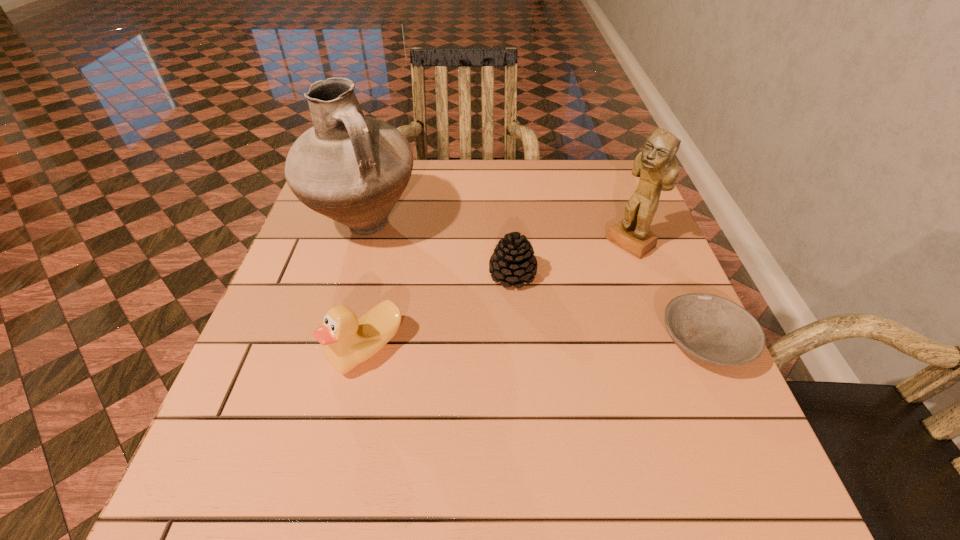
The height and width of the screenshot is (540, 960). I want to click on free space between the pinecone and the shortest object, so click(609, 309).

Find the location of `unoccupied position between the bowl and the duck`. unoccupied position between the bowl and the duck is located at coordinates (536, 346).

At what (x,y) coordinates should I click in order to perform the action: click on free spot between the third object from right to left and the pitcher. Please return your answer as a coordinate pair (x, y). This screenshot has height=540, width=960. Looking at the image, I should click on (439, 250).

What are the coordinates of `free space between the duck and the fourth shortest object` in the screenshot? It's located at (498, 296).

Locate an element on the screen. This screenshot has width=960, height=540. vacant space that's between the tallest object and the figurine is located at coordinates (497, 234).

The height and width of the screenshot is (540, 960). I want to click on vacant area that lies between the pinecone and the second tallest object, so click(571, 259).

Find the location of a particular element. This screenshot has height=540, width=960. free space between the duck and the third object from left to right is located at coordinates (440, 312).

Where is `unoccupied area between the pitcher and the third object from right to left`? The height and width of the screenshot is (540, 960). unoccupied area between the pitcher and the third object from right to left is located at coordinates [x=439, y=250].

Identify the location of empty space between the duck and the bowl. (536, 346).

Where is `vacant area that lies between the pinecone and the bowl`? vacant area that lies between the pinecone and the bowl is located at coordinates (609, 309).